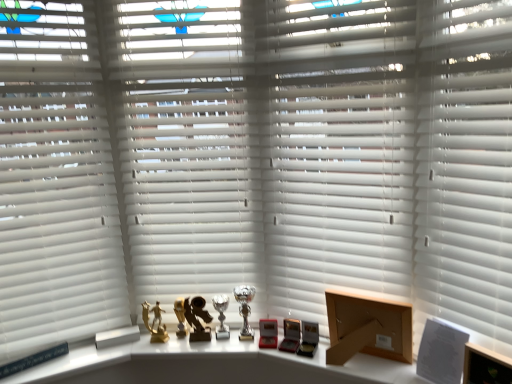
Identify the location of vacant region to the left of gold metallic figurine at center, placed as the 1th toy when sorted from left to right. Image resolution: width=512 pixels, height=384 pixels. (122, 349).